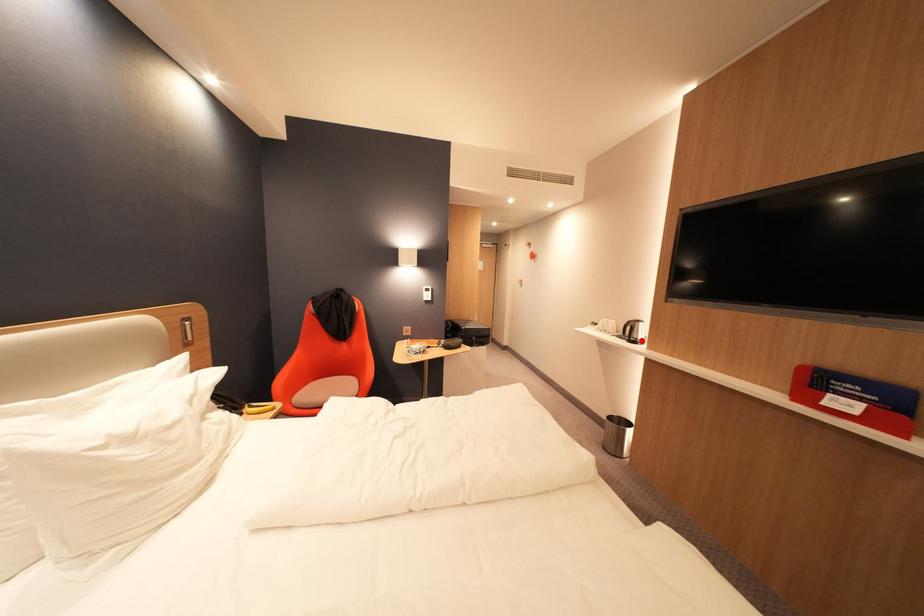
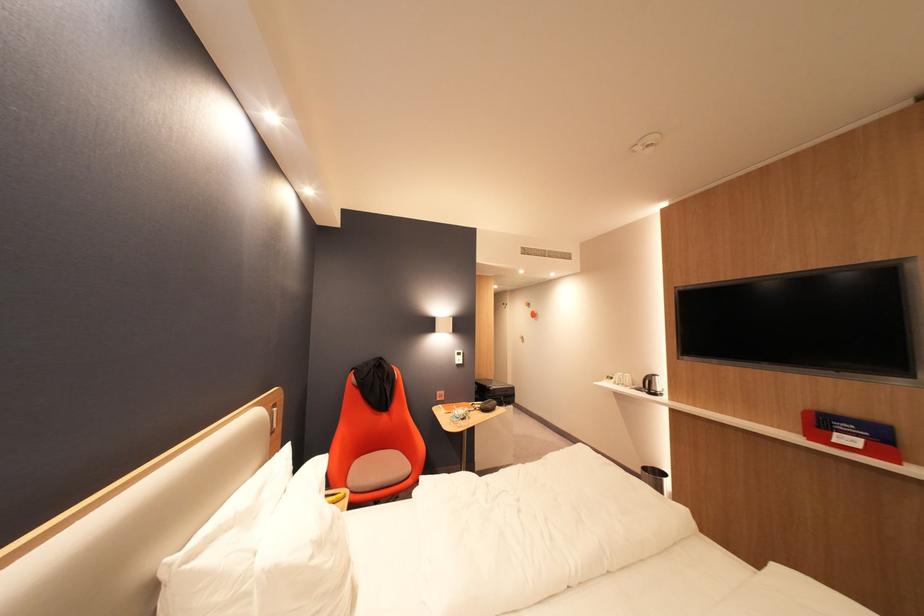
Find the pixel in the second image that matches the highlighted location in the first image.

(662, 392)